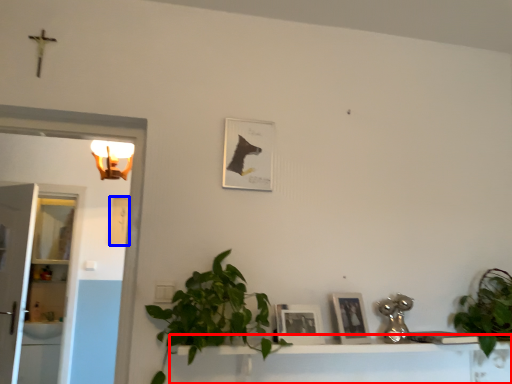
Question: Which object appears farthest to the camera in this image, vanity (highlighted by a red box) or picture frame (highlighted by a blue box)?

Choices:
 (A) vanity
 (B) picture frame

Answer: (B)